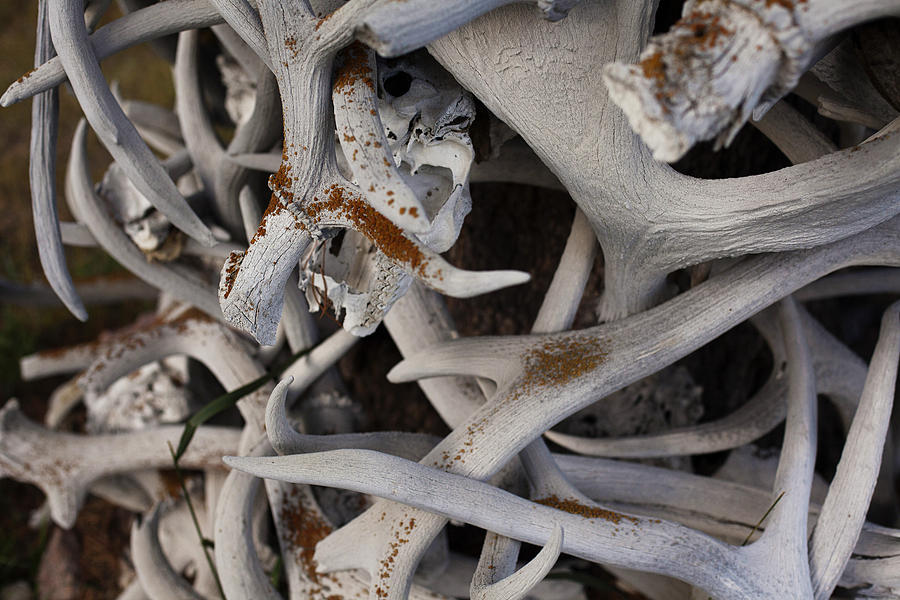
At what (x,y) coordinates should I click in order to perform the action: click on velvet. Please return your answer as a coordinate pair (x, y). Image resolution: width=900 pixels, height=600 pixels. Looking at the image, I should click on pos(403,256).